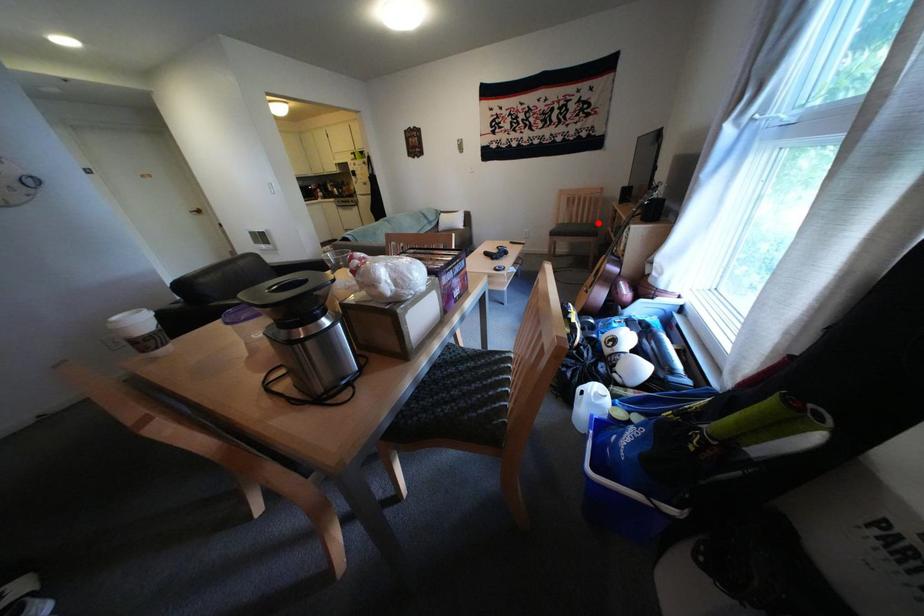
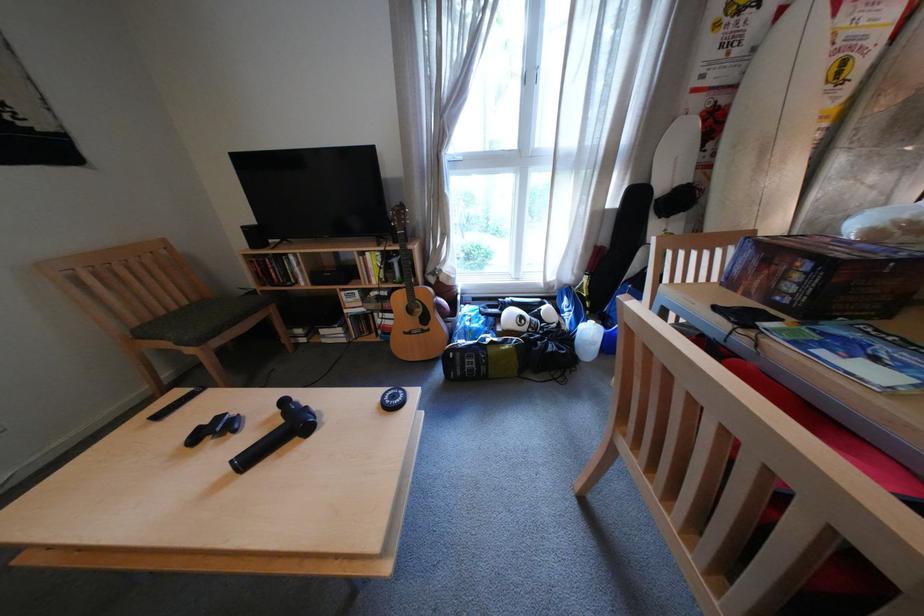
Question: I am providing you with two images of the same scene from different viewpoints. Given a red point in image1, look at the same physical point in image2. Is it:

Choices:
 (A) Closer to the viewpoint
 (B) Farther from the viewpoint

Answer: (B)